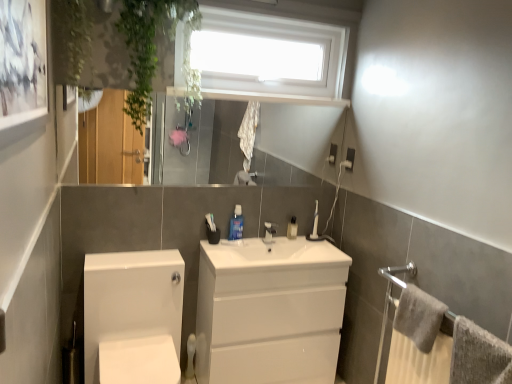
Question: Does white ceramic tap at center have a smaller size compared to blue glossy mouthwash at center, the second toiletry viewed from the right?

Choices:
 (A) no
 (B) yes

Answer: (B)

Question: Does white ceramic tap at center appear on the right side of blue glossy mouthwash at center, which ranks as the first toiletry in left-to-right order?

Choices:
 (A) yes
 (B) no

Answer: (A)

Question: Can you confirm if white ceramic tap at center is thinner than blue glossy mouthwash at center, the second toiletry viewed from the right?

Choices:
 (A) no
 (B) yes

Answer: (B)

Question: Is white ceramic tap at center shorter than blue glossy mouthwash at center, the first toiletry when ordered from front to back?

Choices:
 (A) no
 (B) yes

Answer: (B)

Question: From a real-world perspective, is white ceramic tap at center physically above blue glossy mouthwash at center, which appears as the second toiletry when viewed from the back?

Choices:
 (A) no
 (B) yes

Answer: (A)

Question: Visually, is white ceramic tap at center positioned to the left or to the right of white plastic toothbrush at center, which is the second toiletry in front-to-back order?

Choices:
 (A) right
 (B) left

Answer: (B)

Question: From the image's perspective, relative to white plastic toothbrush at center, placed as the first toiletry when sorted from right to left, is white ceramic tap at center above or below?

Choices:
 (A) below
 (B) above

Answer: (A)

Question: In terms of height, does white ceramic tap at center look taller or shorter compared to white plastic toothbrush at center, which is the second toiletry in front-to-back order?

Choices:
 (A) short
 (B) tall

Answer: (A)

Question: Is white ceramic tap at center wider or thinner than white plastic toothbrush at center, which is counted as the 2th toiletry, starting from the left?

Choices:
 (A) wide
 (B) thin

Answer: (B)

Question: Would you say gray textured towel at lower right, which is the 2th bath towel in back-to-front order, is to the left or to the right of white plastic toothbrush at center, which is the second toiletry in front-to-back order, in the picture?

Choices:
 (A) right
 (B) left

Answer: (A)

Question: Looking at their shapes, would you say gray textured towel at lower right, which is the 2th bath towel in back-to-front order, is wider or thinner than white plastic toothbrush at center, which is the second toiletry in front-to-back order?

Choices:
 (A) wide
 (B) thin

Answer: (A)

Question: Is point 453,374 positioned closer to the camera than point 294,220?

Choices:
 (A) closer
 (B) farther

Answer: (A)

Question: Considering the positions of gray textured towel at lower right, the first bath towel when ordered from front to back, and white plastic toothbrush at center, which ranks as the 1th toiletry in back-to-front order, in the image, is gray textured towel at lower right, the first bath towel when ordered from front to back, taller or shorter than white plastic toothbrush at center, which ranks as the 1th toiletry in back-to-front order,?

Choices:
 (A) short
 (B) tall

Answer: (B)

Question: From the image's perspective, is white plastic toothbrush at center, which is counted as the 2th toiletry, starting from the left, located above or below blue glossy mouthwash at center, the second toiletry viewed from the right?

Choices:
 (A) above
 (B) below

Answer: (B)

Question: Is white plastic toothbrush at center, which is counted as the 2th toiletry, starting from the left, spatially inside blue glossy mouthwash at center, the first toiletry when ordered from front to back, or outside of it?

Choices:
 (A) inside
 (B) outside

Answer: (B)